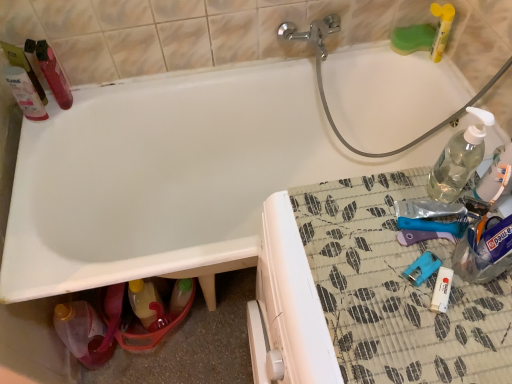
Locate an element on the screen. The image size is (512, 384). vacant area that is in front of translucent plastic bottle at upper left, arranged as the 5th bottle when ordered from the bottom is located at coordinates (36, 141).